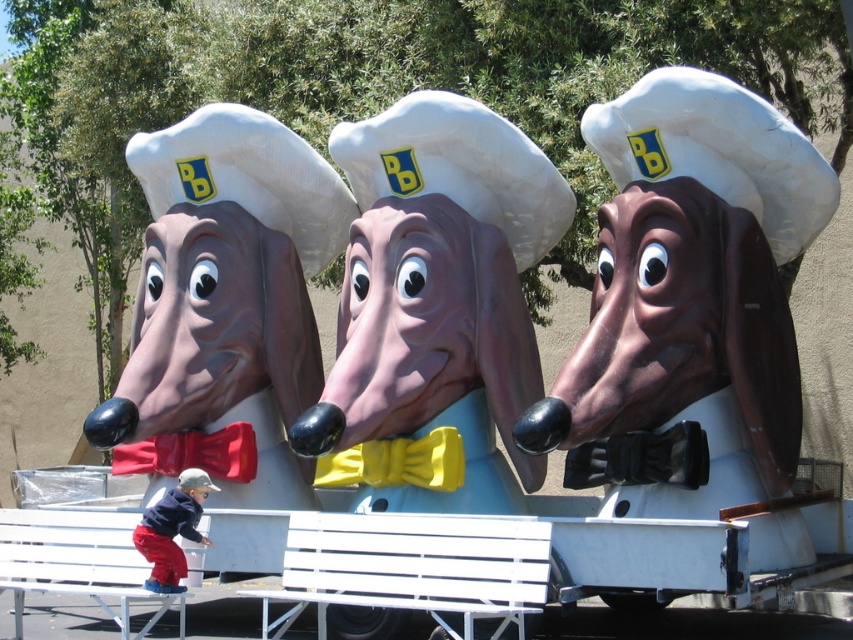
You are standing in front of the dachshund chef sculptures and want to sit down to take a photo. Is the white plastic bench at lower left close enough for you to comfortably reach while sitting?

The white plastic bench at lower left is 8.68 meters away from the viewer. Since this distance is quite far, sitting on the bench might not allow you to comfortably reach the sculptures for a photo.

You are standing in front of the float with the three dachshund chef sculptures. You notice two points marked on the float at coordinates point (461, 547) and point (178, 525). If you want to place a small decoration closer to the viewer, which point should you choose?

You should choose point (461, 547) because it is closer to the viewer than point (178, 525).

You are standing at the center of the image. Which direction should you move to reach the white plastic bench at lower left?

You should move to the lower left direction to reach the white plastic bench at lower left.